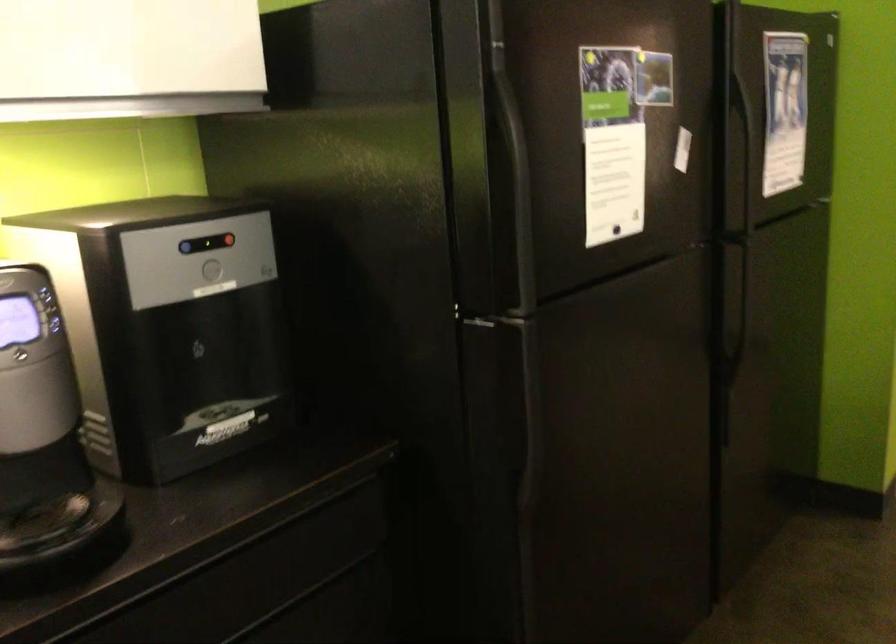
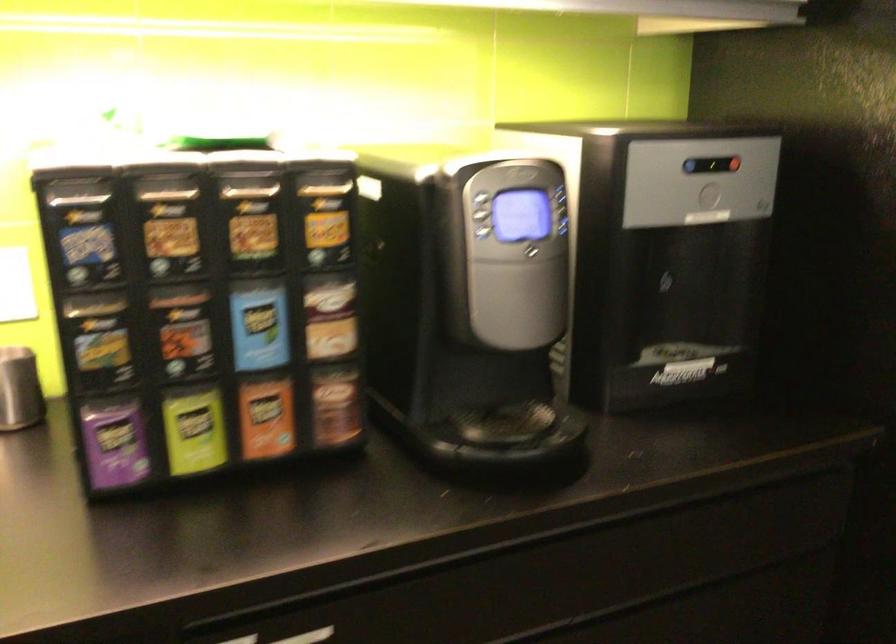
Locate, in the second image, the point that corresponds to point (218, 243) in the first image.

(724, 163)